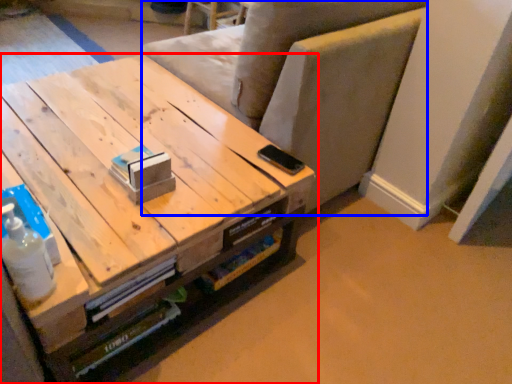
Question: Which point is closer to the camera, table (highlighted by a red box) or armchair (highlighted by a blue box)?

Choices:
 (A) table
 (B) armchair

Answer: (A)